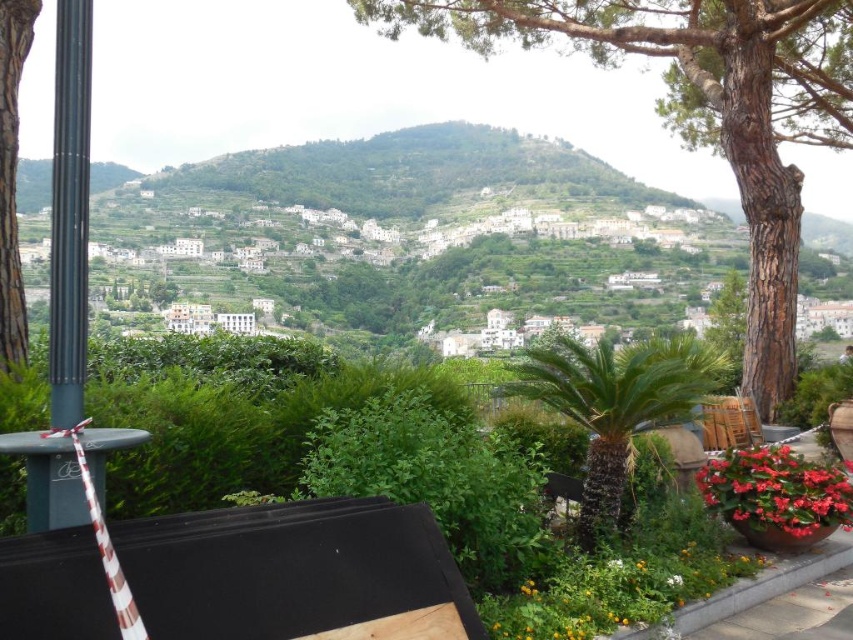
You are a gardener standing in the garden area and want to place a new decorative statue between the green leafy palm at center and the vivid red petals at lower right. Based on their positions, which object should the statue be closer to?

The statue should be placed closer to the vivid red petals at lower right since the green leafy palm at center is positioned on the left side of the vivid red petals at lower right, meaning the red petals are to the right of the palm. Therefore, placing the statue between them would require it to be closer to the red petals to maintain symmetry or balance.